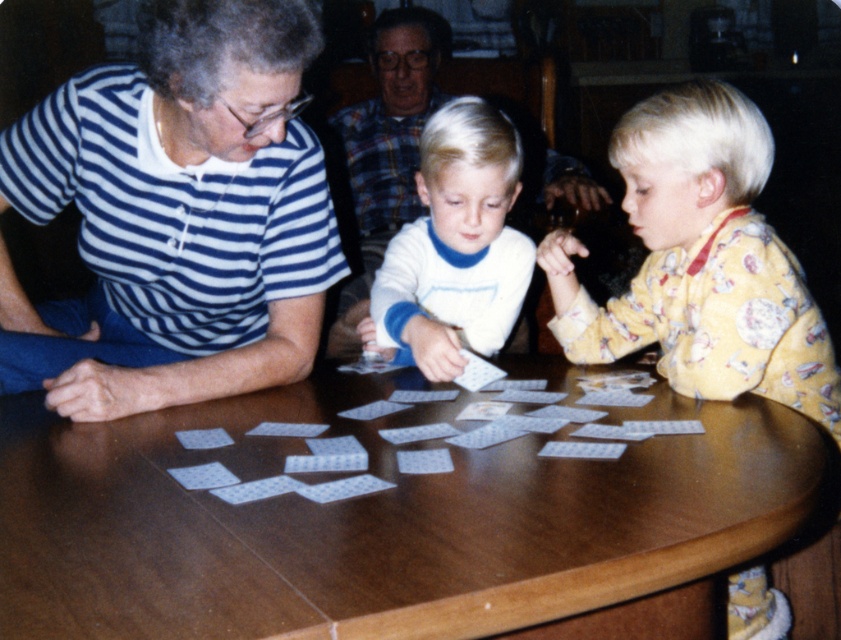
You are a photographer trying to capture a candid shot of the family card game. You need to ensure that both the yellow cotton pajamas at right and the translucent plastic cards at center are clearly visible in the frame. Given their sizes, which object should you focus on first to ensure proper focus?

The yellow cotton pajamas at right is taller than the translucent plastic cards at center, so focusing on the yellow cotton pajamas at right first will ensure proper focus since it is larger and more prominent in the scene.

You are a photographer trying to capture a candid shot of the family card game. You need to position your camera so that both the yellow cotton pajamas at right and the white soft cotton shirt at center are visible in the frame. Based on their positions, where should you aim the camera?

You should aim the camera at the center of the table since the yellow cotton pajamas at right is below the white soft cotton shirt at center, meaning they are positioned lower and to the right. By focusing on the center, both items will be within the frame.

Looking at this image, you are a guest at this family gathering and want to place a small gift on the wooden table at center without disturbing the translucent plastic cards at center. Where should you place it?

The wooden table at center is positioned on the left side of the translucent plastic cards at center, so you should place the gift on the right side of the translucent plastic cards at center to avoid disturbing them.